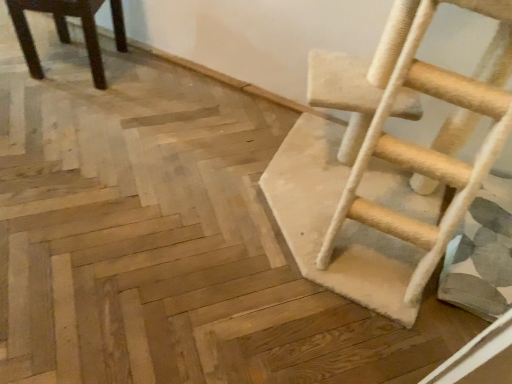
You are a GUI agent. You are given a task and a screenshot of the screen. Output one action in this format:
    pyautogui.click(x=<x>, y=<y>)
    Task: Click on the vacant region below dark brown wood chair at upper left (from a real-world perspective)
    The width and height of the screenshot is (512, 384).
    Given the screenshot: What is the action you would take?
    pyautogui.click(x=84, y=69)